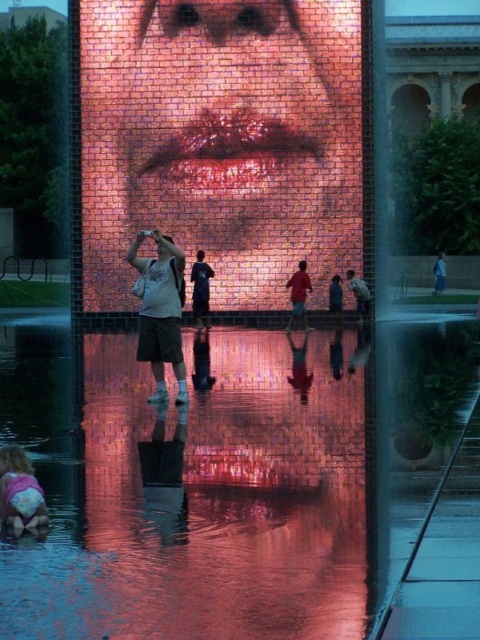
Does glossy reflective water at center appear on the left side of matte red shirt at center?

Correct, you'll find glossy reflective water at center to the left of matte red shirt at center.

Does glossy reflective water at center lie in front of matte red shirt at center?

Yes.

Which is behind, point (7, 609) or point (302, 310)?

The point (302, 310) is more distant.

Where is `glossy reflective water at center`? This screenshot has width=480, height=640. glossy reflective water at center is located at coordinates (227, 477).

Between dark blue jeans at center and matte gray shirt at center, which one has more height?

Standing taller between the two is dark blue jeans at center.

Is point (203, 289) farther from camera compared to point (359, 284)?

No, (203, 289) is in front of (359, 284).

What do you see at coordinates (201, 289) in the screenshot? Image resolution: width=480 pixels, height=640 pixels. I see `dark blue jeans at center` at bounding box center [201, 289].

You are a GUI agent. You are given a task and a screenshot of the screen. Output one action in this format:
    pyautogui.click(x=<x>, y=<y>)
    Task: Click on the dark blue jeans at center
    
    Given the screenshot: What is the action you would take?
    pyautogui.click(x=201, y=289)

Does glossy reflective water at center come behind pink fabric at lower left?

That is False.

Does glossy reflective water at center have a smaller size compared to pink fabric at lower left?

Incorrect, glossy reflective water at center is not smaller in size than pink fabric at lower left.

The height and width of the screenshot is (640, 480). I want to click on glossy reflective water at center, so click(x=227, y=477).